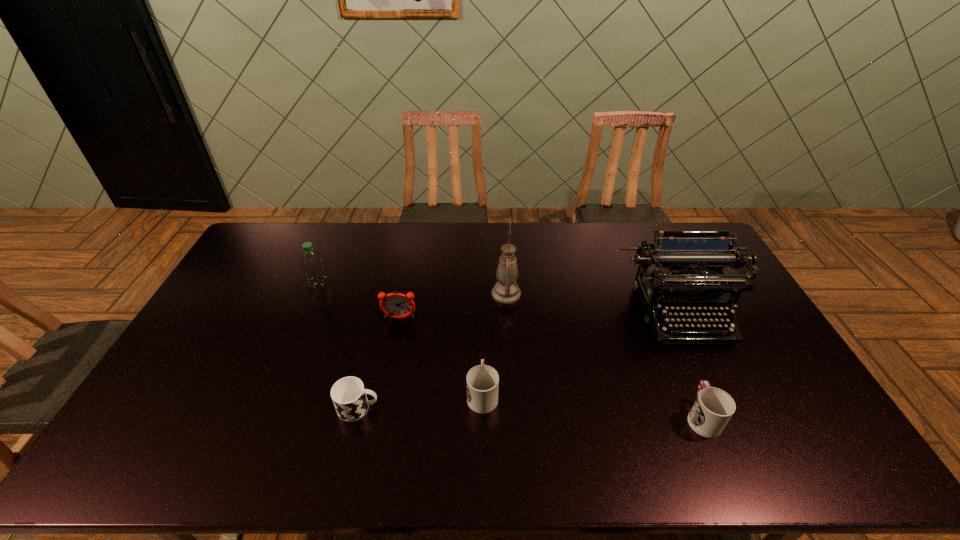
Where is `vacant region located on the keyboard of the typewriter`? Image resolution: width=960 pixels, height=540 pixels. vacant region located on the keyboard of the typewriter is located at coordinates (734, 422).

In order to click on free space located on the right of the leftmost object in this screenshot , I will do `click(434, 284)`.

Locate an element on the screen. The height and width of the screenshot is (540, 960). free space located on the front-facing side of the fourth tallest object is located at coordinates (394, 348).

Locate an element on the screen. Image resolution: width=960 pixels, height=540 pixels. free space located 0.380m on the handle side of the second cup from left to right is located at coordinates (482, 286).

Find the location of a particular element. Image resolution: width=960 pixels, height=540 pixels. free space located on the handle side of the second cup from left to right is located at coordinates (482, 354).

Image resolution: width=960 pixels, height=540 pixels. What are the coordinates of `vacant region located 0.360m on the handle side of the second cup from left to right` in the screenshot? It's located at (482, 289).

You are a GUI agent. You are given a task and a screenshot of the screen. Output one action in this format:
    pyautogui.click(x=<x>, y=<y>)
    Task: Click on the vacant space located 0.080m on the side of the rightmost cup where the handle is located
    The width and height of the screenshot is (960, 540).
    Given the screenshot: What is the action you would take?
    pyautogui.click(x=684, y=373)

The image size is (960, 540). In order to click on free space located on the side of the rightmost cup where the handle is located in this screenshot , I will do `click(659, 315)`.

In order to click on vacant space located on the side of the rightmost cup where the handle is located in this screenshot , I will do `click(657, 310)`.

At what (x,y) coordinates should I click in order to perform the action: click on vacant position located 0.120m on the side of the shortest object with the handle. Please return your answer as a coordinate pair (x, y). The height and width of the screenshot is (540, 960). Looking at the image, I should click on (424, 408).